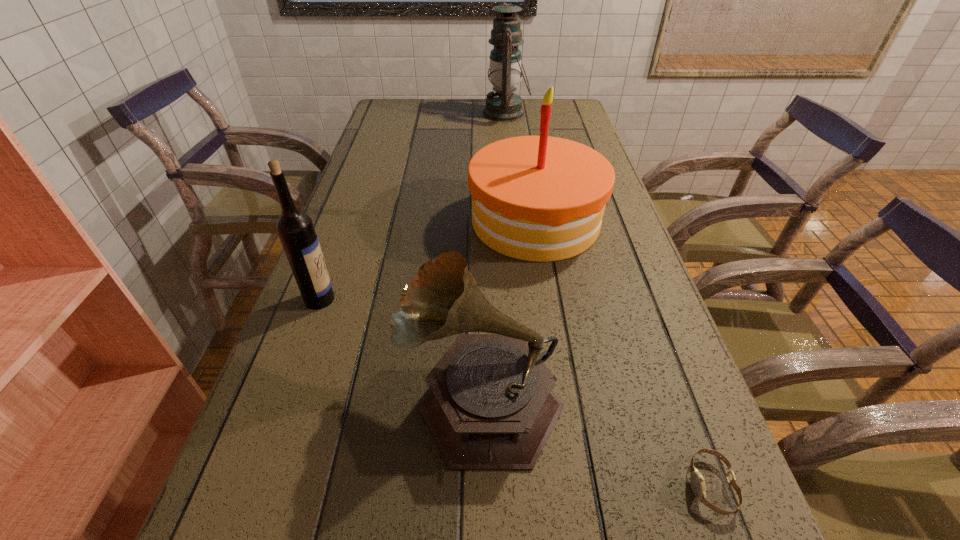
Find the location of a particular element. The image size is (960, 540). the farthest object is located at coordinates (505, 69).

In order to click on the fourth nearest object in this screenshot , I will do `click(536, 198)`.

Locate an element on the screen. the third farthest object is located at coordinates (295, 228).

In order to click on the leftmost object in this screenshot , I will do `click(295, 228)`.

Find the location of a particular element. The height and width of the screenshot is (540, 960). the second shortest object is located at coordinates 490,406.

The height and width of the screenshot is (540, 960). What are the coordinates of `the shortest object` in the screenshot? It's located at (697, 482).

At what (x,y) coordinates should I click in order to perform the action: click on free space located 0.110m on the left of the oil lamp. Please return your answer as a coordinate pair (x, y). This screenshot has width=960, height=540. Looking at the image, I should click on (454, 113).

The width and height of the screenshot is (960, 540). I want to click on vacant space located on the left of the birthday cake, so click(x=449, y=221).

This screenshot has width=960, height=540. I want to click on free location located 0.170m on the label of the third nearest object, so click(x=414, y=299).

I want to click on free location located 0.240m on the horn direction of the fourth tallest object, so click(263, 397).